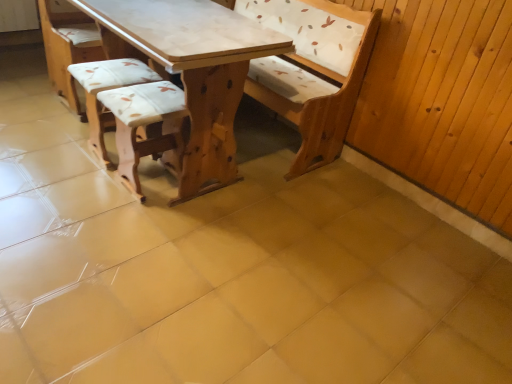
Find the location of `free spot to the right of wooden textured stool at center, which is the first armchair in right-to-left order`. free spot to the right of wooden textured stool at center, which is the first armchair in right-to-left order is located at coordinates (209, 207).